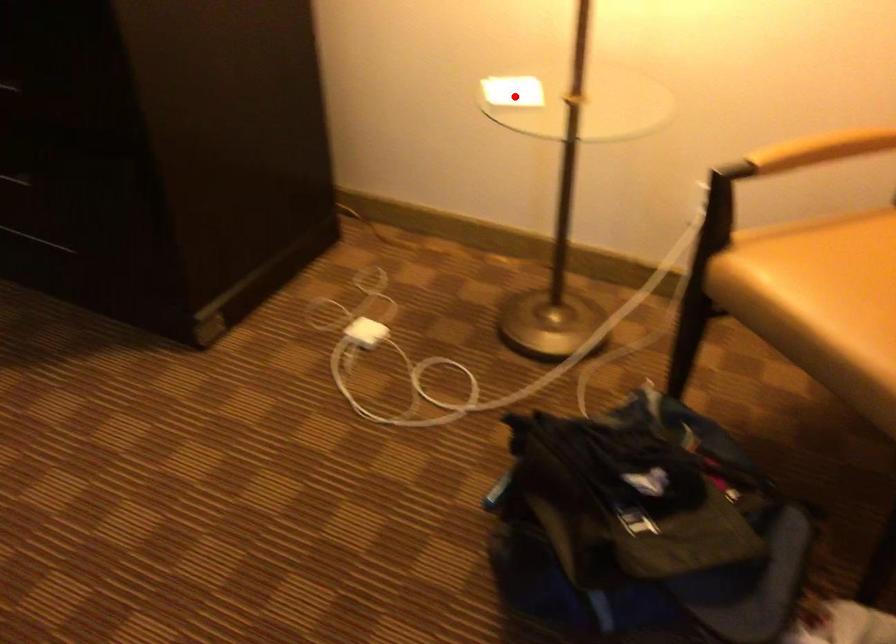
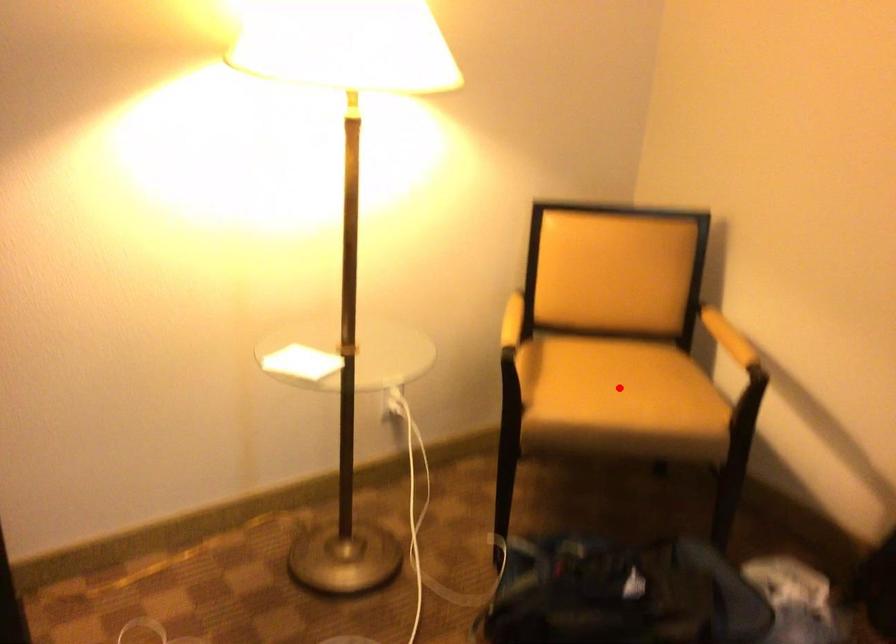
I am providing you with two images of the same scene from different viewpoints. A red point is marked on the first image and another point is marked on the second image. Is the red point in image1 aligned with the point shown in image2?

No